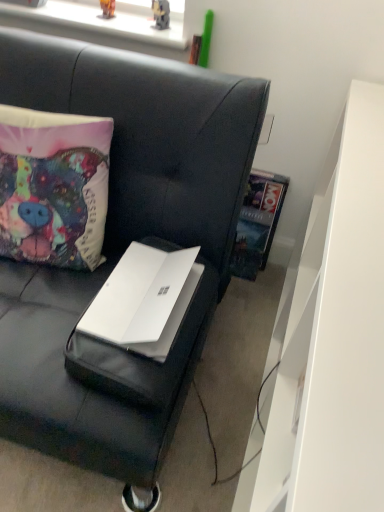
The width and height of the screenshot is (384, 512). What do you see at coordinates (161, 13) in the screenshot?
I see `metallic plastic toy at upper center, the 1th toy positioned from the right` at bounding box center [161, 13].

Image resolution: width=384 pixels, height=512 pixels. I want to click on metallic plastic toy at upper center, the second toy in the left-to-right sequence, so click(161, 13).

What do you see at coordinates (330, 339) in the screenshot? I see `white matte dresser at right` at bounding box center [330, 339].

What is the approximate height of matte plastic toy at upper center, which is the 1th toy in left-to-right order?

It is 3.14 inches.

You are a GUI agent. You are given a task and a screenshot of the screen. Output one action in this format:
    pyautogui.click(x=<x>, y=<y>)
    Task: Click on the matte plastic toy at upper center, which is the 1th toy in left-to-right order
    The width and height of the screenshot is (384, 512).
    Given the screenshot: What is the action you would take?
    pyautogui.click(x=107, y=8)

At what (x,y) coordinates should I click in order to perform the action: click on matte fabric pillow at left. Please return your answer as a coordinate pair (x, y). The width and height of the screenshot is (384, 512). Looking at the image, I should click on (53, 187).

Considering the relative sizes of matte fabric pillow at left and white matte dresser at right in the image provided, is matte fabric pillow at left thinner than white matte dresser at right?

Indeed, matte fabric pillow at left has a lesser width compared to white matte dresser at right.

From a real-world perspective, who is located lower, matte fabric pillow at left or white matte dresser at right?

white matte dresser at right, from a real-world perspective.

Which of these two, matte fabric pillow at left or white matte dresser at right, is bigger?

Bigger between the two is white matte dresser at right.

How distant is matte fabric pillow at left from white matte dresser at right?

matte fabric pillow at left is 25.54 inches away from white matte dresser at right.

Which of these two, white matte laptop at center or matte fabric pillow at left, is bigger?

white matte laptop at center is bigger.

How many degrees apart are the facing directions of white matte laptop at center and matte fabric pillow at left?

white matte laptop at center and matte fabric pillow at left are facing 5.32 degrees away from each other.

Based on the photo, can you confirm if white matte laptop at center is wider than matte fabric pillow at left?

Yes.

Based on the photo, from the image's perspective, which is above, white matte laptop at center or matte fabric pillow at left?

matte fabric pillow at left.

Considering the relative positions of matte plastic toy at upper center, which ranks as the 2th toy in right-to-left order, and white matte laptop at center in the image provided, is matte plastic toy at upper center, which ranks as the 2th toy in right-to-left order, to the right of white matte laptop at center from the viewer's perspective?

No.

Is matte plastic toy at upper center, which is the 1th toy in left-to-right order, positioned with its back to white matte laptop at center?

That's not correct — matte plastic toy at upper center, which is the 1th toy in left-to-right order, is not looking away from white matte laptop at center.

Is matte plastic toy at upper center, which ranks as the 2th toy in right-to-left order, not inside white matte laptop at center?

Absolutely, matte plastic toy at upper center, which ranks as the 2th toy in right-to-left order, is external to white matte laptop at center.

Is metallic plastic toy at upper center, the 1th toy positioned from the right, inside white matte dresser at right?

No, metallic plastic toy at upper center, the 1th toy positioned from the right, is not inside white matte dresser at right.

Is point (325, 224) positioned before point (163, 5)?

Yes, it is.

How different are the orientations of white matte dresser at right and metallic plastic toy at upper center, the second toy in the left-to-right sequence, in degrees?

There is a 62.8-degree angle between the facing directions of white matte dresser at right and metallic plastic toy at upper center, the second toy in the left-to-right sequence.

Considering the sizes of white matte dresser at right and metallic plastic toy at upper center, the second toy in the left-to-right sequence, in the image, is white matte dresser at right taller or shorter than metallic plastic toy at upper center, the second toy in the left-to-right sequence,?

Clearly, white matte dresser at right is taller compared to metallic plastic toy at upper center, the second toy in the left-to-right sequence.

Who is bigger, white matte laptop at center or metallic plastic toy at upper center, the 1th toy positioned from the right?

With larger size is white matte laptop at center.

Is white matte laptop at center aimed at metallic plastic toy at upper center, the second toy in the left-to-right sequence?

No.

From the picture: Is white matte laptop at center next to metallic plastic toy at upper center, the 1th toy positioned from the right, and touching it?

No, white matte laptop at center is not with metallic plastic toy at upper center, the 1th toy positioned from the right.

Is point (159, 369) closer to camera compared to point (190, 270)?

That is True.

Relative to white matte laptop at center, is white matte laptop at center in front or behind?

In the image, white matte laptop at center appears in front of white matte laptop at center.

From a real-world perspective, is white matte laptop at center physically above white matte laptop at center?

No, from a real-world perspective, white matte laptop at center is not above white matte laptop at center.

Considering the sizes of white matte laptop at center and white matte laptop at center in the image, is white matte laptop at center taller or shorter than white matte laptop at center?

Considering their sizes, white matte laptop at center has more height than white matte laptop at center.

From the image's perspective, which is above, white matte dresser at right or matte fabric pillow at left?

matte fabric pillow at left.

Is white matte dresser at right turned away from matte fabric pillow at left?

No.

Which object is closer to the camera taking this photo, white matte dresser at right or matte fabric pillow at left?

white matte dresser at right is in front.

Which of these two, white matte dresser at right or matte fabric pillow at left, is thinner?

With smaller width is matte fabric pillow at left.

You are a GUI agent. You are given a task and a screenshot of the screen. Output one action in this format:
    pyautogui.click(x=<x>, y=<y>)
    Task: Click on the pillow on the left of the white matte dresser at right
    The width and height of the screenshot is (384, 512).
    Given the screenshot: What is the action you would take?
    pyautogui.click(x=53, y=187)

You are a GUI agent. You are given a task and a screenshot of the screen. Output one action in this format:
    pyautogui.click(x=<x>, y=<y>)
    Task: Click on the studio couch below the matte fabric pillow at left (from the image's perspective)
    Image resolution: width=384 pixels, height=512 pixels.
    Given the screenshot: What is the action you would take?
    pyautogui.click(x=123, y=247)

When comparing their distances from hardcover book at upper right, does white matte laptop at center or metallic plastic toy at upper center, the 1th toy positioned from the right, seem further?

Among the two, metallic plastic toy at upper center, the 1th toy positioned from the right, is located further to hardcover book at upper right.

Based on the photo, considering their positions, is metallic plastic toy at upper center, the second toy in the left-to-right sequence, positioned closer to white matte laptop at center than matte plastic toy at upper center, which is the 1th toy in left-to-right order?

Among the two, metallic plastic toy at upper center, the second toy in the left-to-right sequence, is located nearer to white matte laptop at center.

Which object lies further to the anchor point matte fabric pillow at left, matte plastic toy at upper center, which ranks as the 2th toy in right-to-left order, or white matte laptop at center?

Among the two, matte plastic toy at upper center, which ranks as the 2th toy in right-to-left order, is located further to matte fabric pillow at left.

From the image, which object appears to be nearer to matte fabric pillow at left, white matte laptop at center or white matte laptop at center?

Based on the image, white matte laptop at center appears to be nearer to matte fabric pillow at left.

From the image, which object appears to be nearer to white matte dresser at right, matte fabric pillow at left or matte plastic toy at upper center, which is the 1th toy in left-to-right order?

matte fabric pillow at left.

Considering their positions, is hardcover book at upper right positioned closer to white matte dresser at right than matte plastic toy at upper center, which ranks as the 2th toy in right-to-left order?

Based on the image, hardcover book at upper right appears to be nearer to white matte dresser at right.

In the scene shown: Estimate the real-world distances between objects in this image. Which object is closer to matte fabric pillow at left, metallic plastic toy at upper center, the 1th toy positioned from the right, or hardcover book at upper right?

The object closer to matte fabric pillow at left is hardcover book at upper right.

When comparing their distances from matte plastic toy at upper center, which ranks as the 2th toy in right-to-left order, does white matte laptop at center or matte fabric pillow at left seem further?

white matte laptop at center is further to matte plastic toy at upper center, which ranks as the 2th toy in right-to-left order.

Identify the location of laptop located between white matte laptop at center and white matte dresser at right in the left-right direction. This screenshot has width=384, height=512. (143, 298).

Identify the location of pillow between metallic plastic toy at upper center, the second toy in the left-to-right sequence, and white matte laptop at center in the up-down direction. (53, 187).

Find the location of a particular element. The width and height of the screenshot is (384, 512). pillow between white matte laptop at center and white matte dresser at right is located at coordinates (53, 187).

The width and height of the screenshot is (384, 512). Identify the location of laptop located between white matte laptop at center and hardcover book at upper right in the depth direction. (143, 298).